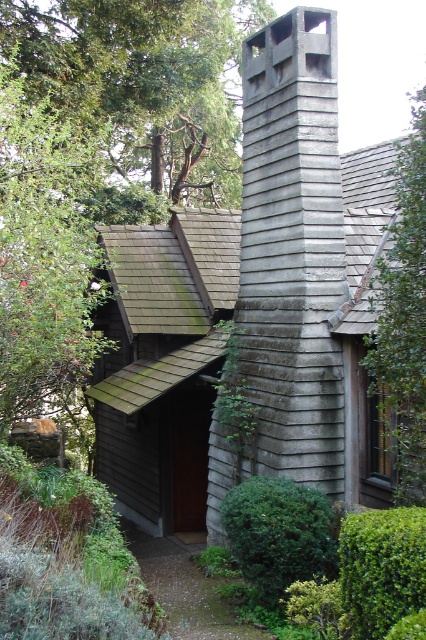
You are standing in front of the rustic house and want to know how far the point at coordinates point (357, 236) is from you. Can you determine the distance?

The point (357, 236) is 10.63 meters from the camera, so the distance is 10.63 meters.

You are standing in front of the wooden cabin at center and want to place a decorative flagpole in front of it. The flagpole needs to be placed in a position where it won not block the view of the gray wood chimney at center from the front. Where should you place the flagpole?

The wooden cabin at center is positioned under the gray wood chimney at center, so placing the flagpole in front of the wooden cabin at center but below the chimney would ensure it does not block the view of the gray wood chimney at center.

You are standing in front of the house and want to compare the sizes of the gray wood chimney at center and the green leafy tree at upper left. Which one appears larger?

The green leafy tree at upper left is larger than the gray wood chimney at center.